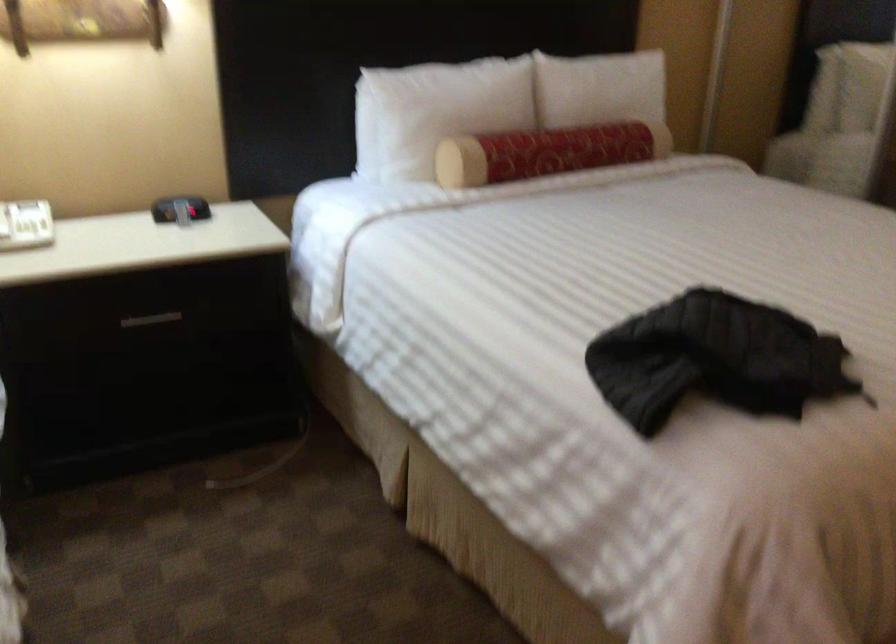
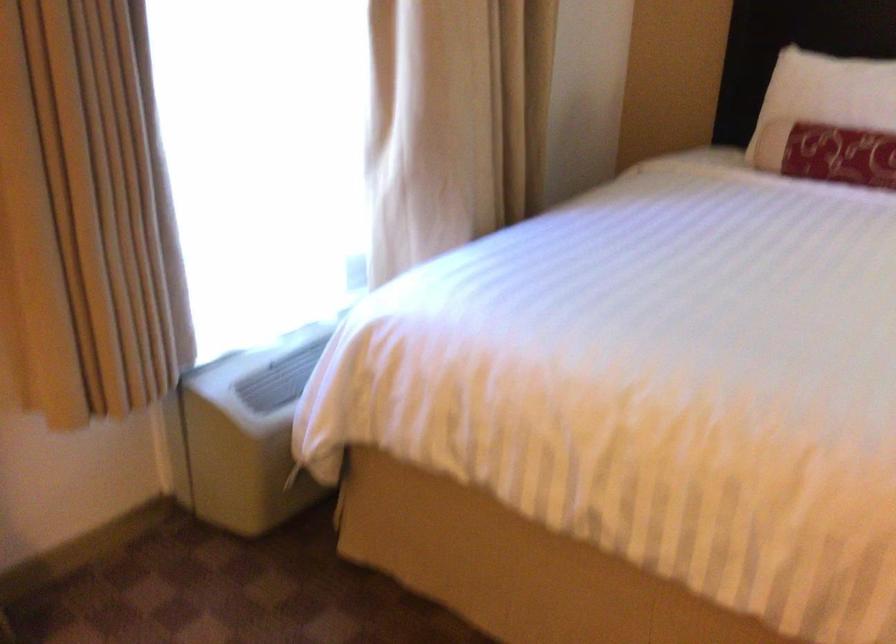
Question: The camera is either moving clockwise (left) or counter-clockwise (right) around the object. The first image is from the beginning of the video and the second image is from the end. Is the camera moving left or right when shooting the video?

Choices:
 (A) Left
 (B) Right

Answer: (B)